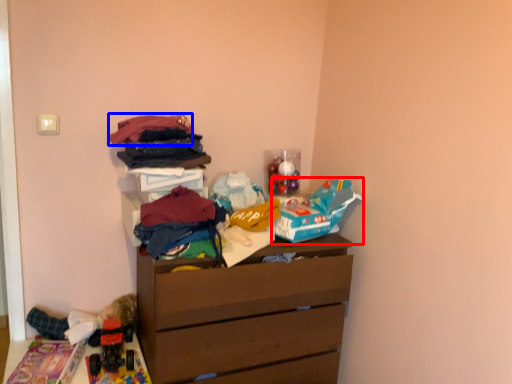
Question: Which point is closer to the camera, toy (highlighted by a red box) or clothing (highlighted by a blue box)?

Choices:
 (A) toy
 (B) clothing

Answer: (B)